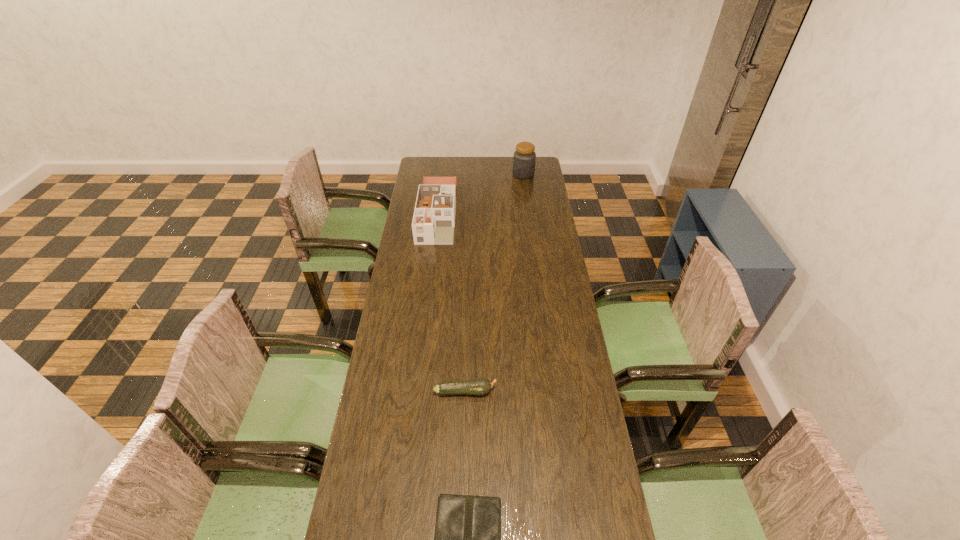
At what (x,y) coordinates should I click in order to perform the action: click on empty location between the third farthest object and the farthest object. Please return your answer as a coordinate pair (x, y). Looking at the image, I should click on (494, 282).

Select which object is the third closest to the zucchini. Please provide its 2D coordinates. Your answer should be formatted as a tuple, i.e. [(x, y)], where the tuple contains the x and y coordinates of a point satisfying the conditions above.

[(524, 158)]

Choose which object is the nearest neighbor to the rightmost object. Please provide its 2D coordinates. Your answer should be formatted as a tuple, i.e. [(x, y)], where the tuple contains the x and y coordinates of a point satisfying the conditions above.

[(433, 222)]

Locate an element on the screen. vacant area in the image that satisfies the following two spatial constraints: 1. on the surface of the rightmost object near the warning symbol; 2. at the front door of the dollhouse is located at coordinates (529, 213).

Where is `vacant point that satisfies the following two spatial constraints: 1. on the surface of the tallest object near the warning symbol; 2. at the front door of the third nearest object`? The image size is (960, 540). vacant point that satisfies the following two spatial constraints: 1. on the surface of the tallest object near the warning symbol; 2. at the front door of the third nearest object is located at coordinates click(529, 213).

Find the location of a particular element. The height and width of the screenshot is (540, 960). free space that satisfies the following two spatial constraints: 1. on the surface of the rightmost object near the warning symbol; 2. at the front door of the third nearest object is located at coordinates (529, 213).

I want to click on vacant region that satisfies the following two spatial constraints: 1. on the surface of the jar near the warning symbol; 2. at the front door of the third shortest object, so click(x=529, y=213).